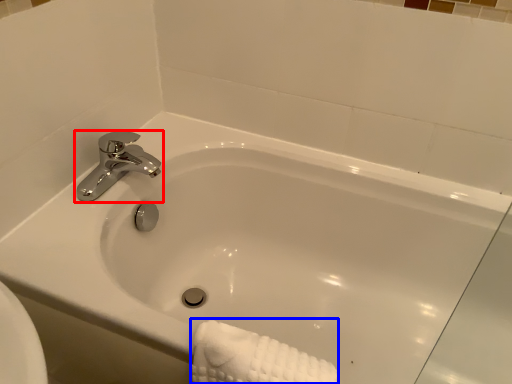
Question: Which of the following is the farthest to the observer, tap (highlighted by a red box) or bath towel (highlighted by a blue box)?

Choices:
 (A) tap
 (B) bath towel

Answer: (A)